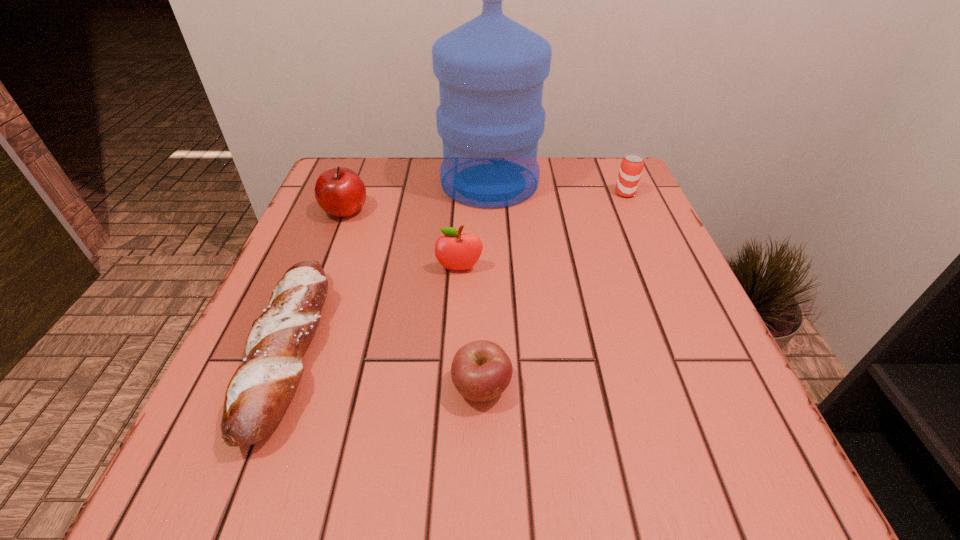
You are a GUI agent. You are given a task and a screenshot of the screen. Output one action in this format:
    pyautogui.click(x=<x>, y=<y>)
    Task: Click on the object at the far right corner
    This screenshot has width=960, height=540.
    Given the screenshot: What is the action you would take?
    pyautogui.click(x=631, y=168)

This screenshot has width=960, height=540. In order to click on vacant space at the far edge of the desktop in this screenshot , I will do `click(441, 193)`.

Identify the location of vacant space at the near edge of the desktop. The height and width of the screenshot is (540, 960). (438, 452).

The image size is (960, 540). In the image, there is a desktop. What are the coordinates of `vacant area at the left edge` in the screenshot? It's located at (309, 424).

Image resolution: width=960 pixels, height=540 pixels. I want to click on vacant position at the right edge of the desktop, so click(x=634, y=315).

In the image, there is a desktop. Where is `vacant space at the far left corner`? Image resolution: width=960 pixels, height=540 pixels. vacant space at the far left corner is located at coordinates (356, 158).

Find the location of `vacant space at the near left corner of the desktop`. vacant space at the near left corner of the desktop is located at coordinates (247, 470).

Identify the location of vacant space at the far right corner of the desktop. Image resolution: width=960 pixels, height=540 pixels. coord(617,198).

Identify the location of free point between the tallest object and the beer can. The height and width of the screenshot is (540, 960). (558, 188).

Image resolution: width=960 pixels, height=540 pixels. Find the location of `free space between the water jug and the shortest apple`. free space between the water jug and the shortest apple is located at coordinates (486, 285).